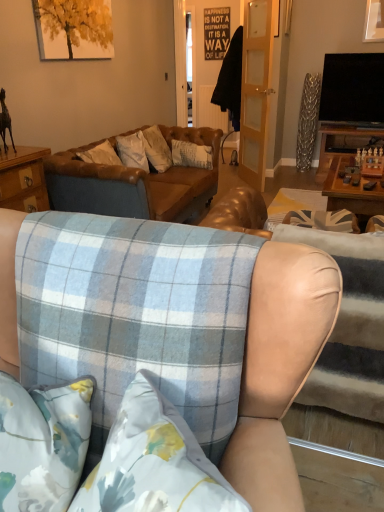
Question: In terms of height, does blue plaid fabric couch at center, which appears as the third studio couch when viewed from the front, look taller or shorter compared to blue plaid fabric at center, positioned as the third studio couch in back-to-front order?

Choices:
 (A) tall
 (B) short

Answer: (B)

Question: Relative to blue plaid fabric at center, placed as the 1th studio couch when sorted from front to back, is blue plaid fabric couch at center, which appears as the third studio couch when viewed from the front, in front or behind?

Choices:
 (A) front
 (B) behind

Answer: (B)

Question: Which is farther from the blue plaid fabric at center, positioned as the third studio couch in back-to-front order?

Choices:
 (A) blue plaid fabric couch at center, positioned as the 1th studio couch in back-to-front order
 (B) blue plaid fabric at center, placed as the second studio couch when sorted from back to front

Answer: (A)

Question: Based on their relative distances, which object is nearer to the blue plaid fabric at center, placed as the second studio couch when sorted from back to front?

Choices:
 (A) blue plaid fabric couch at center, which appears as the third studio couch when viewed from the front
 (B) blue plaid fabric at center, placed as the 1th studio couch when sorted from front to back

Answer: (B)